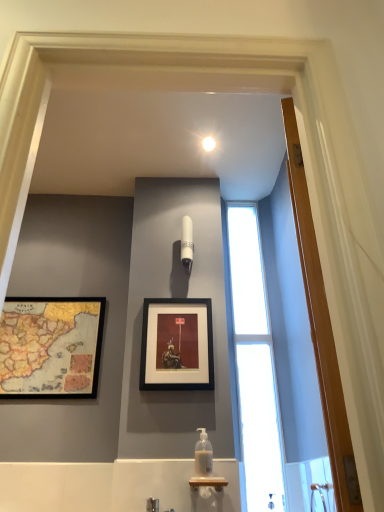
Locate an element on the screen. The image size is (384, 512). vacant space to the right of white glossy light fixture at upper center is located at coordinates (245, 143).